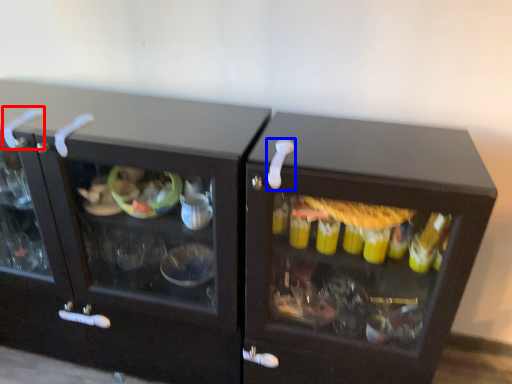
Question: Which point is further to the camera, door handle (highlighted by a red box) or door handle (highlighted by a blue box)?

Choices:
 (A) door handle
 (B) door handle

Answer: (A)